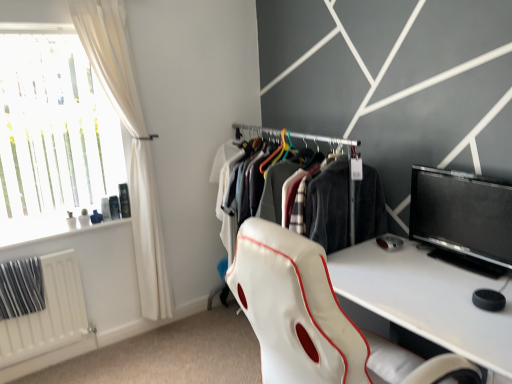
Question: From the image's perspective, relative to translucent glass window at upper left, is white matte radiator at lower left above or below?

Choices:
 (A) below
 (B) above

Answer: (A)

Question: In terms of size, does white matte radiator at lower left appear bigger or smaller than translucent glass window at upper left?

Choices:
 (A) small
 (B) big

Answer: (A)

Question: Estimate the real-world distances between objects in this image. Which object is farther from the translucent glass window at upper left?

Choices:
 (A) white fabric closet at center
 (B) black glossy monitor at right
 (C) white matte radiator at lower left
 (D) white leather chair at center
 (E) white fabric curtain at left

Answer: (B)

Question: Based on their relative distances, which object is farther from the white leather chair at center?

Choices:
 (A) translucent glass window at upper left
 (B) white fabric closet at center
 (C) black glossy monitor at right
 (D) white matte radiator at lower left
 (E) white fabric curtain at left

Answer: (A)